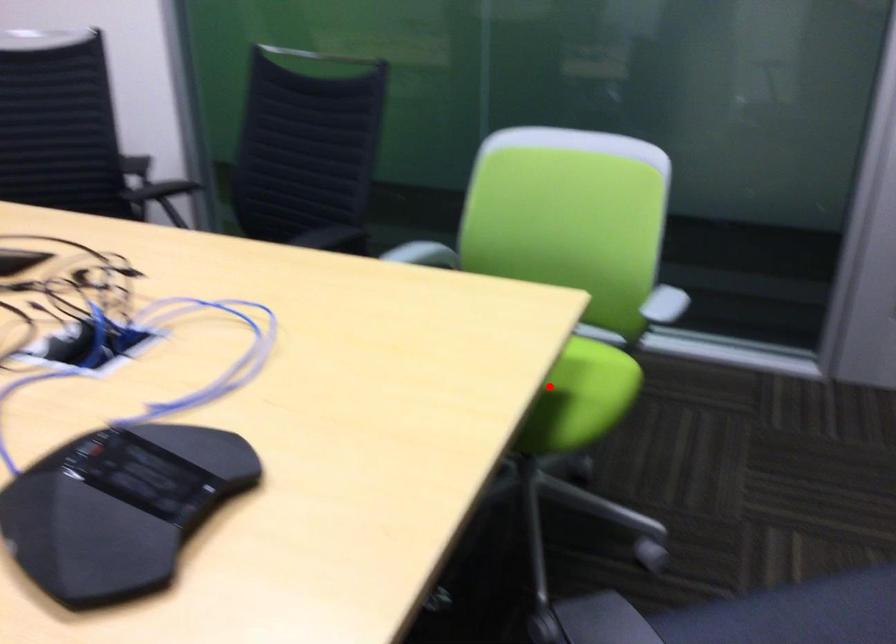
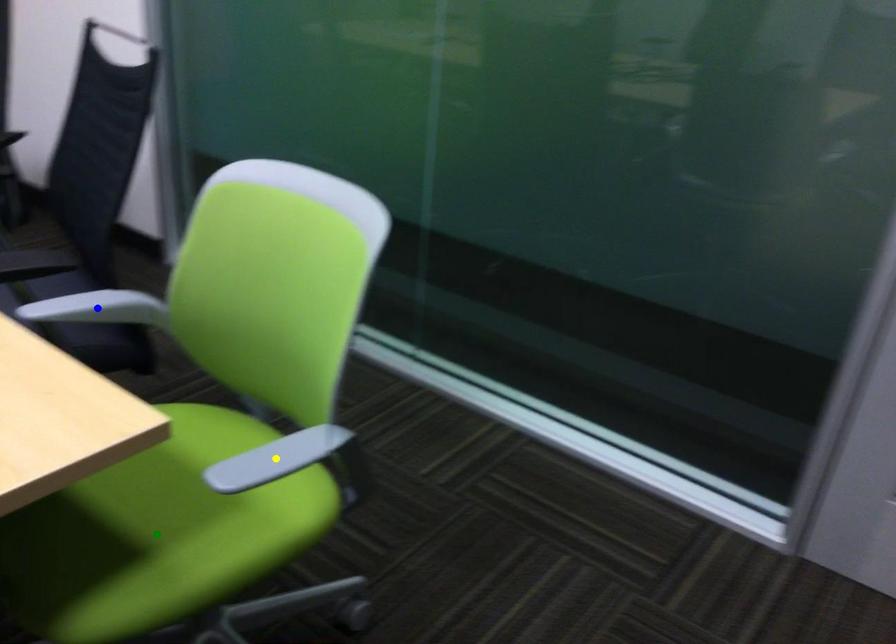
Question: I am providing you with two images of the same scene from different viewpoints. A red point is marked on the first image. You are given multiple points on the second image. Which point in image 2 represents the same 3d spot as the red point in image 1?

Choices:
 (A) green point
 (B) yellow point
 (C) blue point

Answer: (A)